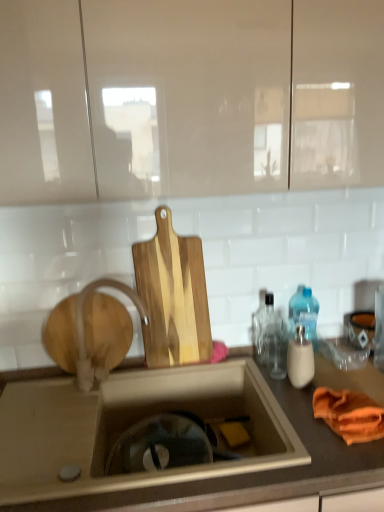
Locate an element on the screen. The width and height of the screenshot is (384, 512). vacant area that is in front of white matte faucet at center is located at coordinates (72, 429).